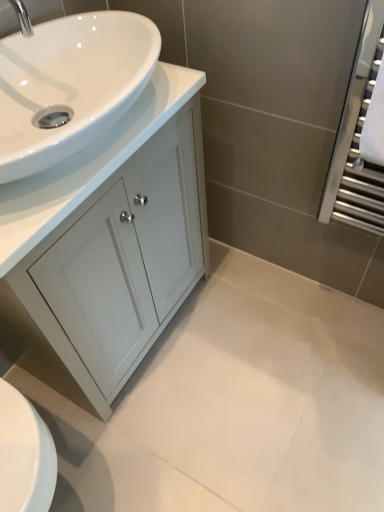
I want to click on spots to the right of white glossy cabinet at left, so click(x=249, y=334).